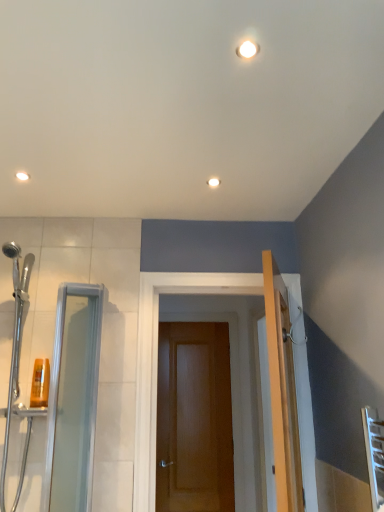
The height and width of the screenshot is (512, 384). I want to click on white glossy light fixture at upper center, so click(213, 182).

The width and height of the screenshot is (384, 512). What do you see at coordinates (15, 345) in the screenshot?
I see `transparent glass shower door at left` at bounding box center [15, 345].

Locate an element on the screen. Image resolution: width=384 pixels, height=512 pixels. translucent plastic shampoo bottle at left is located at coordinates (40, 383).

Describe the element at coordinates (73, 399) in the screenshot. Image resolution: width=384 pixels, height=512 pixels. I see `clear glass screen door at left` at that location.

Measure the distance between clear glass screen door at left and camera.

clear glass screen door at left is 5.92 feet from camera.

In order to face wooden door at center, should I rotate leftwards or rightwards?

Rotate right and turn 0.818 degrees.

Locate an element on the screen. white glossy light fixture at upper center is located at coordinates pyautogui.click(x=213, y=182).

Which of these two, transparent glass shower door at left or translucent plastic shampoo bottle at left, is bigger?

transparent glass shower door at left is bigger.

Can you confirm if transparent glass shower door at left is thinner than translucent plastic shampoo bottle at left?

No, transparent glass shower door at left is not thinner than translucent plastic shampoo bottle at left.

Is transparent glass shower door at left facing away from translucent plastic shampoo bottle at left?

Yes, translucent plastic shampoo bottle at left is at the back of transparent glass shower door at left.

I want to click on screen door that is on the left side of wooden door at center, so click(x=73, y=399).

Is wooden door at center at the right side of clear glass screen door at left?

Indeed, wooden door at center is positioned on the right side of clear glass screen door at left.

Considering the positions of objects translucent plastic shampoo bottle at left and wooden door at center in the image provided, who is more to the right, translucent plastic shampoo bottle at left or wooden door at center?

wooden door at center is more to the right.

In terms of height, does translucent plastic shampoo bottle at left look taller or shorter compared to wooden door at center?

Clearly, translucent plastic shampoo bottle at left is shorter compared to wooden door at center.

Based on the photo, is wooden door at center surrounded by translucent plastic shampoo bottle at left?

Actually, wooden door at center is outside translucent plastic shampoo bottle at left.

Consider the image. Would you consider translucent plastic shampoo bottle at left to be distant from wooden door at center?

Indeed, translucent plastic shampoo bottle at left is not near wooden door at center.

What's the angular difference between translucent plastic shampoo bottle at left and clear glass screen door at left's facing directions?

2.57 degrees.

Which object is positioned more to the left, translucent plastic shampoo bottle at left or clear glass screen door at left?

translucent plastic shampoo bottle at left.

From the picture: From the image's perspective, is translucent plastic shampoo bottle at left located beneath clear glass screen door at left?

No, from the image's perspective, translucent plastic shampoo bottle at left is not beneath clear glass screen door at left.

Is translucent plastic shampoo bottle at left not within clear glass screen door at left?

Yes, translucent plastic shampoo bottle at left is located beyond the bounds of clear glass screen door at left.

Is white glossy light fixture at upper center beside translucent plastic shampoo bottle at left?

No, white glossy light fixture at upper center is not next to translucent plastic shampoo bottle at left.

Is white glossy light fixture at upper center thinner than translucent plastic shampoo bottle at left?

In fact, white glossy light fixture at upper center might be wider than translucent plastic shampoo bottle at left.

From the image's perspective, is white glossy light fixture at upper center above or below translucent plastic shampoo bottle at left?

Based on their image positions, white glossy light fixture at upper center is located above translucent plastic shampoo bottle at left.

How different are the orientations of white glossy light fixture at upper center and translucent plastic shampoo bottle at left in degrees?

The angle between the facing direction of white glossy light fixture at upper center and the facing direction of translucent plastic shampoo bottle at left is 2.86 degrees.

Is white glossy light fixture at upper center far from transparent glass shower door at left?

Yes, white glossy light fixture at upper center and transparent glass shower door at left are located far from each other.

Does white glossy light fixture at upper center have a lesser width compared to transparent glass shower door at left?

Yes.

From the image's perspective, which is above, white glossy light fixture at upper center or transparent glass shower door at left?

white glossy light fixture at upper center.

Is there a large distance between wooden door at center and white glossy light fixture at upper center?

Indeed, wooden door at center is not near white glossy light fixture at upper center.

In the image, there is a white glossy light fixture at upper center. In order to click on door below it (from a real-world perspective) in this screenshot , I will do `click(194, 419)`.

Can you confirm if wooden door at center is taller than white glossy light fixture at upper center?

Correct, wooden door at center is much taller as white glossy light fixture at upper center.

Considering the positions of points (164, 494) and (215, 177), is point (164, 494) farther from camera compared to point (215, 177)?

Yes, point (164, 494) is behind point (215, 177).

Find the location of a particular element. The height and width of the screenshot is (512, 384). shower door located above the translucent plastic shampoo bottle at left (from the image's perspective) is located at coordinates (15, 345).

Identify the location of door behind the clear glass screen door at left. (194, 419).

From the image, which object appears to be nearer to wooden door at center, white glossy light fixture at upper center or clear glass screen door at left?

The object closer to wooden door at center is clear glass screen door at left.

Based on their spatial positions, is transparent glass shower door at left or white glossy light fixture at upper center further from translucent plastic shampoo bottle at left?

white glossy light fixture at upper center.

Which object lies nearer to the anchor point transparent glass shower door at left, wooden door at center or clear glass screen door at left?

The object closer to transparent glass shower door at left is clear glass screen door at left.

Which object lies further to the anchor point wooden door at center, clear glass screen door at left or translucent plastic shampoo bottle at left?

translucent plastic shampoo bottle at left is positioned further to the anchor wooden door at center.

Which object lies further to the anchor point clear glass screen door at left, wooden door at center or transparent glass shower door at left?

Among the two, wooden door at center is located further to clear glass screen door at left.

When comparing their distances from white glossy light fixture at upper center, does wooden door at center or clear glass screen door at left seem further?

wooden door at center is positioned further to the anchor white glossy light fixture at upper center.

Looking at the image, which one is located closer to white glossy light fixture at upper center, transparent glass shower door at left or translucent plastic shampoo bottle at left?

Based on the image, translucent plastic shampoo bottle at left appears to be nearer to white glossy light fixture at upper center.

Considering their positions, is clear glass screen door at left positioned closer to wooden door at center than transparent glass shower door at left?

The object closer to wooden door at center is clear glass screen door at left.

Locate an element on the screen. Image resolution: width=384 pixels, height=512 pixels. toiletry between clear glass screen door at left and wooden door at center in the front-back direction is located at coordinates pos(40,383).

Find the location of a particular element. The image size is (384, 512). screen door between transparent glass shower door at left and translucent plastic shampoo bottle at left in the front-back direction is located at coordinates (73, 399).

At what (x,y) coordinates should I click in order to perform the action: click on toiletry that lies between white glossy light fixture at upper center and clear glass screen door at left from top to bottom. Please return your answer as a coordinate pair (x, y). Looking at the image, I should click on point(40,383).

Find the location of `screen door positioned between transparent glass shower door at left and wooden door at center from near to far`. screen door positioned between transparent glass shower door at left and wooden door at center from near to far is located at coordinates (73, 399).